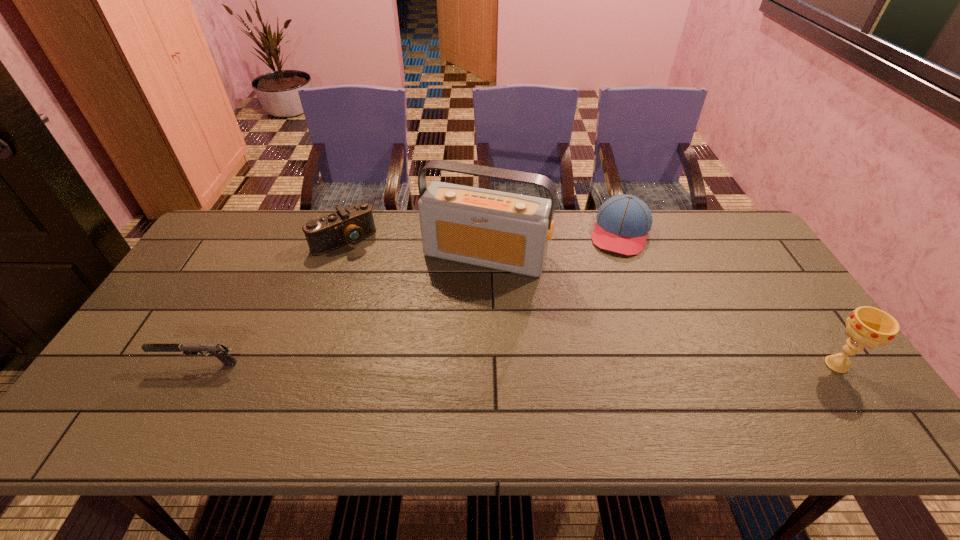
Find the location of `radio receiver at the far edge`. radio receiver at the far edge is located at coordinates click(505, 231).

Locate an element on the screen. This screenshot has width=960, height=540. baseball cap at the far edge is located at coordinates (623, 221).

This screenshot has width=960, height=540. Identify the location of camera present at the far edge. (351, 225).

The image size is (960, 540). I want to click on object located at the near edge, so click(x=870, y=327).

The height and width of the screenshot is (540, 960). I want to click on object that is positioned at the left edge, so click(x=220, y=351).

Locate an element on the screen. The height and width of the screenshot is (540, 960). object that is at the right edge is located at coordinates (870, 327).

Locate an element on the screen. object situated at the near right corner is located at coordinates (870, 327).

Identify the location of free location at the far edge of the desktop. This screenshot has width=960, height=540. (348, 252).

Where is `free space at the near edge of the desktop`? free space at the near edge of the desktop is located at coordinates (552, 380).

Identify the location of vacant region at the left edge. click(x=210, y=319).